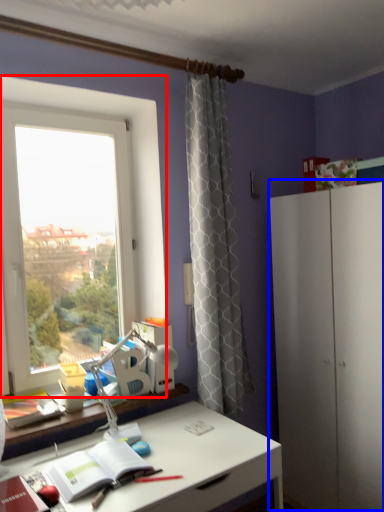
Question: Which of the following is the closest to the observer, window (highlighted by a red box) or dresser (highlighted by a blue box)?

Choices:
 (A) window
 (B) dresser

Answer: (B)